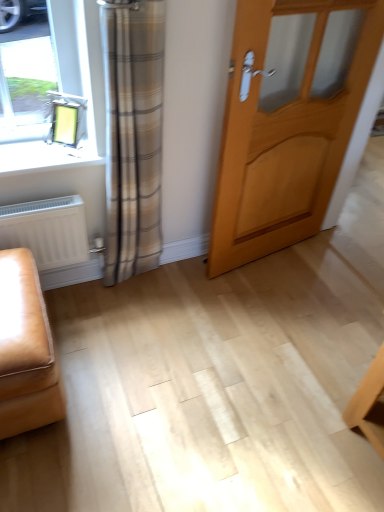
Where is `free spot below light wood door at center (from a real-world perspective)`? The image size is (384, 512). free spot below light wood door at center (from a real-world perspective) is located at coordinates (274, 255).